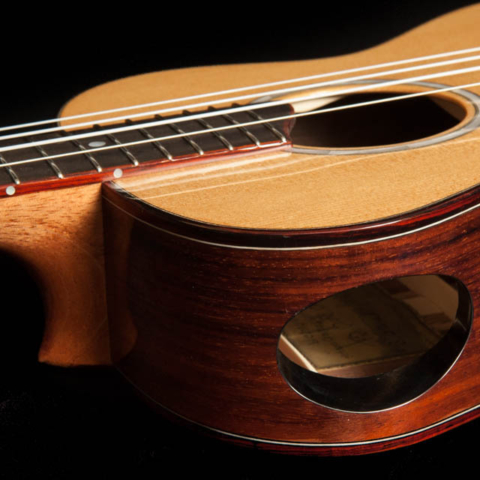
Where is `dark wood`? dark wood is located at coordinates (223, 326).